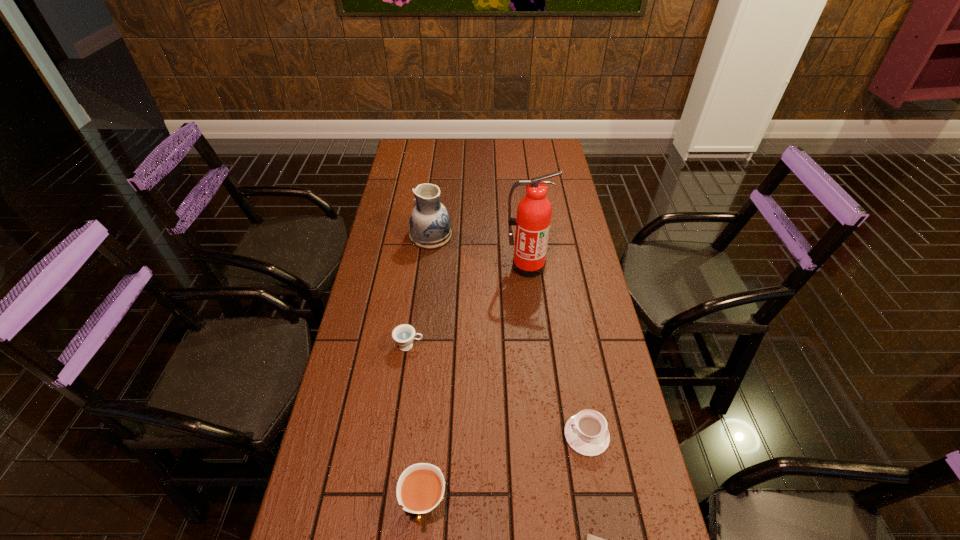
Where is `object that is the third closest to the rightmost teacup`? The height and width of the screenshot is (540, 960). object that is the third closest to the rightmost teacup is located at coordinates (404, 334).

You are a GUI agent. You are given a task and a screenshot of the screen. Output one action in this format:
    pyautogui.click(x=<x>, y=<y>)
    Task: Click on the teacup that is the third closest one to the diary
    Image resolution: width=960 pixels, height=540 pixels.
    Given the screenshot: What is the action you would take?
    pyautogui.click(x=404, y=334)

Identify which teacup is located as the second nearest to the pottery. Please provide its 2D coordinates. Your answer should be formatted as a tuple, i.e. [(x, y)], where the tuple contains the x and y coordinates of a point satisfying the conditions above.

[(586, 432)]

This screenshot has width=960, height=540. Identify the location of vacant area in the image that satisfies the following two spatial constraints: 1. on the label side of the tallest object; 2. on the side of the farthest teacup with the handle. (535, 346).

Identify the location of free space that satisfies the following two spatial constraints: 1. on the label side of the fifth nearest object; 2. on the side of the farthest teacup with the handle. The image size is (960, 540). (535, 346).